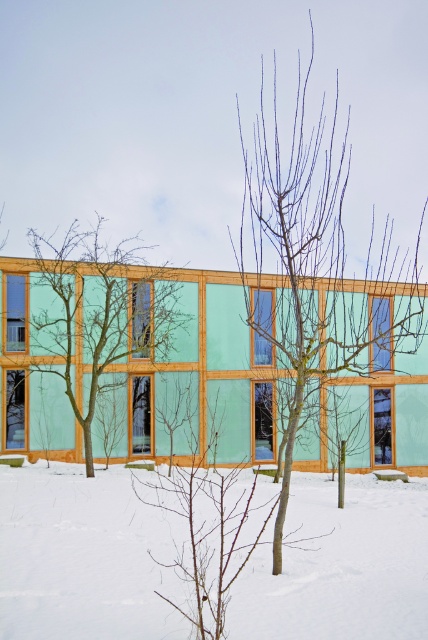
You are standing in front of the building and want to walk to the green matte tree at left. Which direction should you move to avoid stepping on the white powdery snow at center?

To avoid stepping on the white powdery snow at center, you should move towards the left side since the green matte tree at left is larger than the snow, indicating it is closer or occupies more space in that direction.

You are an architect analyzing the building facade. You notice two trees in the scene. Which tree has a narrower width between the bare branches at center and the green matte tree at left?

The bare branches at center has a narrower width than the green matte tree at left.

You are standing in front of the modern building with pastel green walls and wooden beams. You notice a point marked at coordinates (x=314, y=257). What object is located at that point?

The point at coordinates (x=314, y=257) corresponds to bare branches at center.